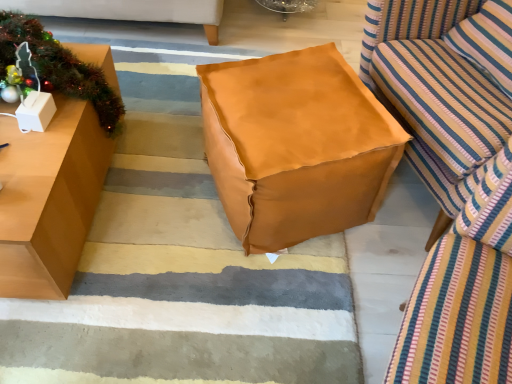
This screenshot has width=512, height=384. Find the location of `free spot in front of leather-like tan bean bag at center`. free spot in front of leather-like tan bean bag at center is located at coordinates (255, 300).